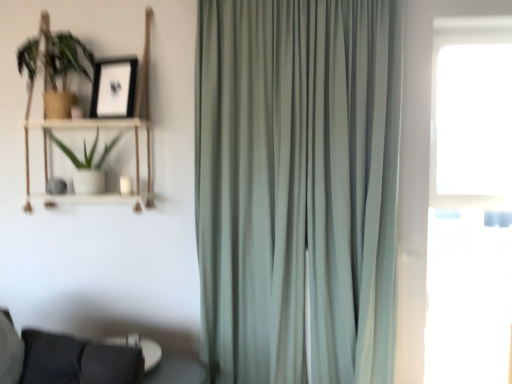
Question: Is white matte pot at left, the first houseplant ordered from the bottom, in front of green matte plant at upper left, the first houseplant from the top?

Choices:
 (A) no
 (B) yes

Answer: (A)

Question: Does white matte pot at left, the first houseplant ordered from the bottom, appear on the left side of green matte plant at upper left, the first houseplant from the top?

Choices:
 (A) no
 (B) yes

Answer: (A)

Question: Considering the relative positions of white matte pot at left, the first houseplant ordered from the bottom, and green matte plant at upper left, the 2th houseplant ordered from the bottom, in the image provided, is white matte pot at left, the first houseplant ordered from the bottom, to the right of green matte plant at upper left, the 2th houseplant ordered from the bottom, from the viewer's perspective?

Choices:
 (A) yes
 (B) no

Answer: (A)

Question: Is green matte plant at upper left, the 2th houseplant ordered from the bottom, at the back of white matte pot at left, the first houseplant ordered from the bottom?

Choices:
 (A) no
 (B) yes

Answer: (A)

Question: Is white matte pot at left, marked as the 2th houseplant in a top-to-bottom arrangement, far away from green matte plant at upper left, the first houseplant from the top?

Choices:
 (A) no
 (B) yes

Answer: (A)

Question: From the image's perspective, relative to transparent glass window at right, is woodenobject at left above or below?

Choices:
 (A) below
 (B) above

Answer: (B)

Question: Looking at their shapes, would you say woodenobject at left is wider or thinner than transparent glass window at right?

Choices:
 (A) wide
 (B) thin

Answer: (B)

Question: Is woodenobject at left to the left or to the right of transparent glass window at right in the image?

Choices:
 (A) right
 (B) left

Answer: (B)

Question: Considering their positions, is woodenobject at left located in front of or behind transparent glass window at right?

Choices:
 (A) behind
 (B) front

Answer: (A)

Question: In terms of width, does white matte pot at left, the first houseplant ordered from the bottom, look wider or thinner when compared to green matte plant at upper left, the first houseplant from the top?

Choices:
 (A) thin
 (B) wide

Answer: (B)

Question: From their relative heights in the image, would you say white matte pot at left, the first houseplant ordered from the bottom, is taller or shorter than green matte plant at upper left, the first houseplant from the top?

Choices:
 (A) tall
 (B) short

Answer: (B)

Question: In the image, is white matte pot at left, marked as the 2th houseplant in a top-to-bottom arrangement, on the left side or the right side of green matte plant at upper left, the 2th houseplant ordered from the bottom?

Choices:
 (A) left
 (B) right

Answer: (B)

Question: Is white matte pot at left, the first houseplant ordered from the bottom, spatially inside green matte plant at upper left, the first houseplant from the top, or outside of it?

Choices:
 (A) outside
 (B) inside

Answer: (A)

Question: In terms of width, does woodenobject at left look wider or thinner when compared to satin green curtain at center?

Choices:
 (A) thin
 (B) wide

Answer: (A)

Question: Considering the positions of woodenobject at left and satin green curtain at center in the image, is woodenobject at left taller or shorter than satin green curtain at center?

Choices:
 (A) tall
 (B) short

Answer: (B)